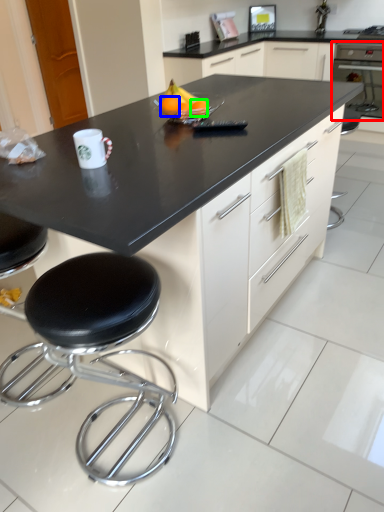
Question: Estimate the real-world distances between objects in this image. Which object is closer to oven (highlighted by a red box), orange (highlighted by a blue box) or orange (highlighted by a green box)?

Choices:
 (A) orange
 (B) orange

Answer: (B)